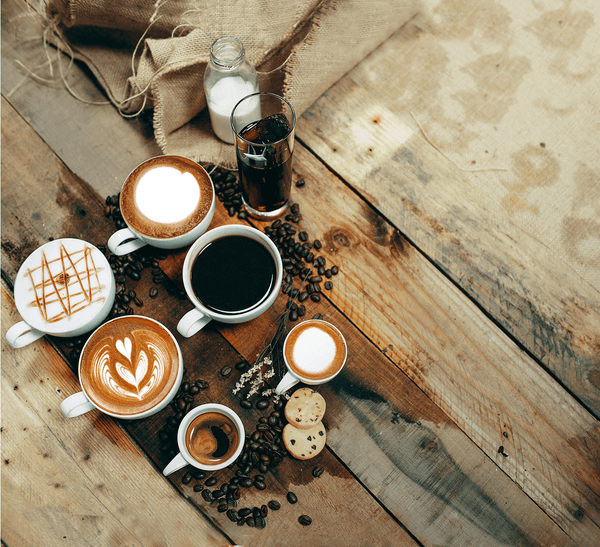
Find the location of a particular element. Image resolution: width=600 pixels, height=547 pixels. mugs of coffee is located at coordinates (82, 276), (150, 212), (231, 260), (110, 380), (216, 448), (327, 356).